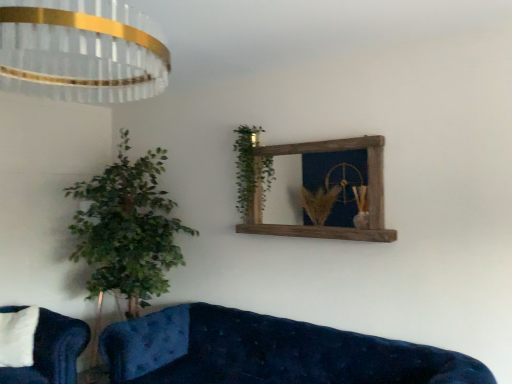
Question: From the image's perspective, is crystal glass chandelier at upper left over velvet blue studio couch at lower left, the 2th studio couch positioned from the front?

Choices:
 (A) no
 (B) yes

Answer: (B)

Question: Is crystal glass chandelier at upper left far from velvet blue studio couch at lower left, the 1th studio couch positioned from the left?

Choices:
 (A) no
 (B) yes

Answer: (B)

Question: Is crystal glass chandelier at upper left aimed at velvet blue studio couch at lower left, the 2th studio couch in the right-to-left sequence?

Choices:
 (A) no
 (B) yes

Answer: (A)

Question: Is crystal glass chandelier at upper left at the right side of velvet blue studio couch at lower left, the 1th studio couch positioned from the left?

Choices:
 (A) yes
 (B) no

Answer: (A)

Question: Can you confirm if crystal glass chandelier at upper left is bigger than velvet blue studio couch at lower left, the 1th studio couch positioned from the left?

Choices:
 (A) no
 (B) yes

Answer: (B)

Question: From a real-world perspective, is crystal glass chandelier at upper left on top of velvet blue studio couch at lower left, the 2th studio couch positioned from the front?

Choices:
 (A) yes
 (B) no

Answer: (A)

Question: Can you confirm if rustic wood mirror at upper center is positioned to the left of green leafy plant at upper center?

Choices:
 (A) yes
 (B) no

Answer: (B)

Question: Considering the relative sizes of rustic wood mirror at upper center and green leafy plant at upper center in the image provided, is rustic wood mirror at upper center smaller than green leafy plant at upper center?

Choices:
 (A) no
 (B) yes

Answer: (A)

Question: From a real-world perspective, is rustic wood mirror at upper center on green leafy plant at upper center?

Choices:
 (A) yes
 (B) no

Answer: (B)

Question: Is rustic wood mirror at upper center oriented towards green leafy plant at upper center?

Choices:
 (A) yes
 (B) no

Answer: (A)

Question: Is rustic wood mirror at upper center at the right side of green leafy plant at upper center?

Choices:
 (A) yes
 (B) no

Answer: (A)

Question: Is rustic wood mirror at upper center positioned behind green leafy plant at upper center?

Choices:
 (A) no
 (B) yes

Answer: (A)

Question: Is green leafy plant at upper center closer to the viewer compared to velvet blue studio couch at lower left, the 1th studio couch positioned from the left?

Choices:
 (A) no
 (B) yes

Answer: (A)